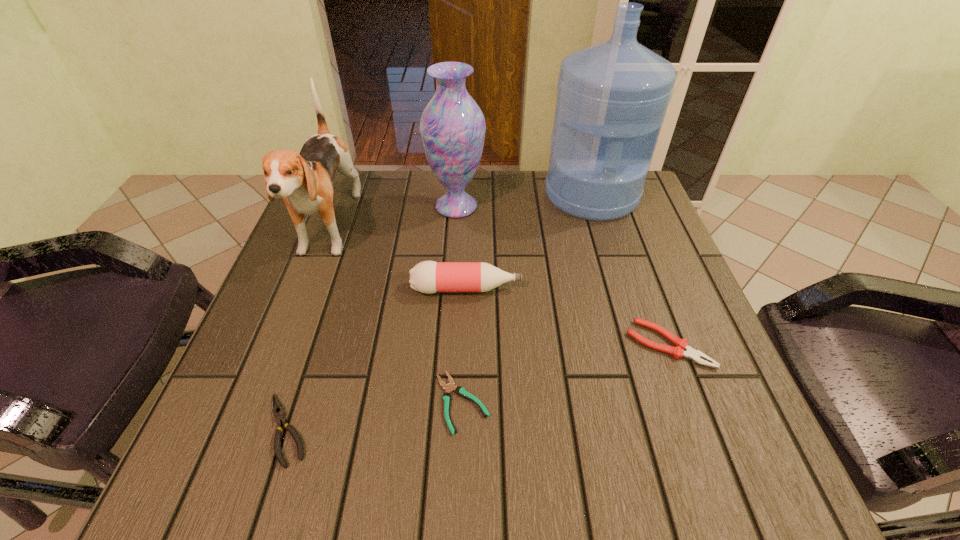
Where is `free space between the fourth tallest object and the shortest object`? The image size is (960, 540). free space between the fourth tallest object and the shortest object is located at coordinates (465, 346).

This screenshot has height=540, width=960. I want to click on free space between the second tallest pliers and the second pliers from left to right, so (374, 416).

This screenshot has height=540, width=960. Find the location of `unoccupied position between the shortest pliers and the vase`. unoccupied position between the shortest pliers and the vase is located at coordinates (459, 305).

Choose which object is the fourth nearest neighbor to the puppy. Please provide its 2D coordinates. Your answer should be formatted as a tuple, i.e. [(x, y)], where the tuple contains the x and y coordinates of a point satisfying the conditions above.

[(450, 387)]

Find the location of a particular element. The image size is (960, 540). object that is the fifth nearest to the second shortest pliers is located at coordinates (696, 356).

Identify which pliers is the second nearest to the vase. Please provide its 2D coordinates. Your answer should be formatted as a tuple, i.e. [(x, y)], where the tuple contains the x and y coordinates of a point satisfying the conditions above.

[(450, 387)]

Choose which pliers is the nearest neighbor to the second pliers from right to left. Please provide its 2D coordinates. Your answer should be formatted as a tuple, i.e. [(x, y)], where the tuple contains the x and y coordinates of a point satisfying the conditions above.

[(278, 411)]

Identify the location of vacant point that satisfies the following two spatial constraints: 1. on the front side of the vase; 2. on the left side of the shortest object. This screenshot has height=540, width=960. (444, 402).

At what (x,y) coordinates should I click in order to perform the action: click on free space that satisfies the following two spatial constraints: 1. with the cap open on the bottle; 2. on the front side of the shortest pliers. Please return your answer as a coordinate pair (x, y). Looking at the image, I should click on (464, 402).

The height and width of the screenshot is (540, 960). What are the coordinates of `blank space that satisfies the following two spatial constraints: 1. with the cap open on the third shortest object; 2. on the left side of the fourth tallest object` in the screenshot? It's located at (465, 345).